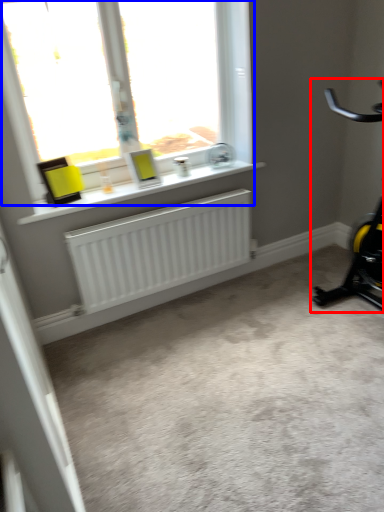
Question: Among these objects, which one is farthest to the camera, stationary bicycle (highlighted by a red box) or window (highlighted by a blue box)?

Choices:
 (A) stationary bicycle
 (B) window

Answer: (B)